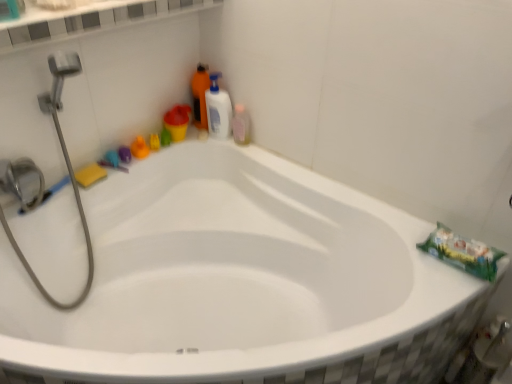
Question: Considering the relative positions of white glossy ledge at upper center and yellow sponge at upper left in the image provided, is white glossy ledge at upper center behind yellow sponge at upper left?

Choices:
 (A) yes
 (B) no

Answer: (B)

Question: Can you confirm if white glossy ledge at upper center is positioned to the left of yellow sponge at upper left?

Choices:
 (A) no
 (B) yes

Answer: (A)

Question: Is white glossy ledge at upper center positioned with its back to yellow sponge at upper left?

Choices:
 (A) yes
 (B) no

Answer: (B)

Question: From the image's perspective, does white glossy ledge at upper center appear higher than yellow sponge at upper left?

Choices:
 (A) no
 (B) yes

Answer: (B)

Question: Can you see white glossy ledge at upper center touching yellow sponge at upper left?

Choices:
 (A) no
 (B) yes

Answer: (A)

Question: From a real-world perspective, is white glossy ledge at upper center positioned over yellow sponge at upper left based on gravity?

Choices:
 (A) yes
 (B) no

Answer: (A)

Question: Are orange matte bottle at upper center, arranged as the 2th cleaning product when viewed from the right, and yellow sponge at upper left far apart?

Choices:
 (A) yes
 (B) no

Answer: (B)

Question: Considering the relative sizes of orange matte bottle at upper center, which is the 1th cleaning product in left-to-right order, and yellow sponge at upper left in the image provided, is orange matte bottle at upper center, which is the 1th cleaning product in left-to-right order, bigger than yellow sponge at upper left?

Choices:
 (A) yes
 (B) no

Answer: (A)

Question: Does orange matte bottle at upper center, arranged as the 2th cleaning product when viewed from the right, touch yellow sponge at upper left?

Choices:
 (A) yes
 (B) no

Answer: (B)

Question: Can you confirm if orange matte bottle at upper center, which is the 1th cleaning product in left-to-right order, is wider than yellow sponge at upper left?

Choices:
 (A) yes
 (B) no

Answer: (A)

Question: Considering the relative sizes of orange matte bottle at upper center, arranged as the 2th cleaning product when viewed from the right, and yellow sponge at upper left in the image provided, is orange matte bottle at upper center, arranged as the 2th cleaning product when viewed from the right, thinner than yellow sponge at upper left?

Choices:
 (A) yes
 (B) no

Answer: (B)

Question: Is yellow sponge at upper left at the back of orange matte bottle at upper center, arranged as the 2th cleaning product when viewed from the right?

Choices:
 (A) no
 (B) yes

Answer: (A)

Question: Is white glossy bottle at upper right, marked as the second cleaning product in a left-to-right arrangement, outside of white glossy ledge at upper center?

Choices:
 (A) yes
 (B) no

Answer: (A)